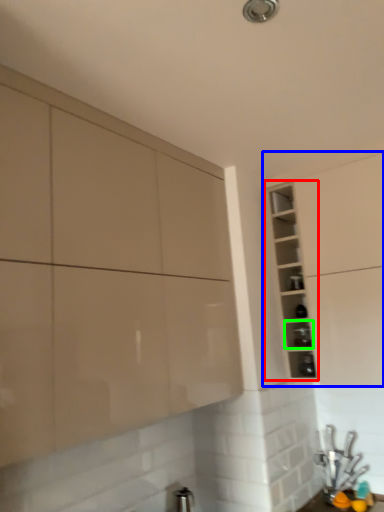
Question: Estimate the real-world distances between objects in this image. Which object is closer to cabinet (highlighted by a red box), cabinetry (highlighted by a blue box) or shelf (highlighted by a green box)?

Choices:
 (A) cabinetry
 (B) shelf

Answer: (A)